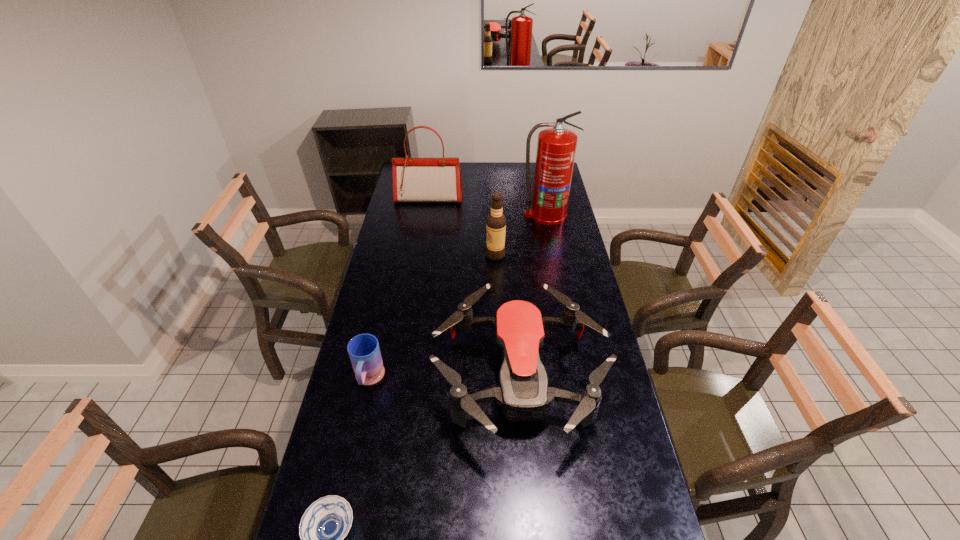
You are a GUI agent. You are given a task and a screenshot of the screen. Output one action in this format:
    pyautogui.click(x=<x>, y=<y>)
    Task: Click on the tallest object
    Image resolution: width=960 pixels, height=540 pixels.
    Given the screenshot: What is the action you would take?
    pos(556,147)

Image resolution: width=960 pixels, height=540 pixels. I want to click on the second farthest object, so click(x=556, y=147).

Where is `the second tallest object`? The image size is (960, 540). the second tallest object is located at coordinates (414, 179).

This screenshot has width=960, height=540. Find the location of `handbag`. handbag is located at coordinates (414, 179).

This screenshot has width=960, height=540. I want to click on the fourth shortest object, so click(x=495, y=222).

Find the location of a particular element. The width and height of the screenshot is (960, 540). the fourth nearest object is located at coordinates (495, 222).

Where is `drone`? drone is located at coordinates (523, 392).

In order to click on the fifth tallest object in this screenshot , I will do `click(364, 351)`.

You are a GUI agent. You are given a task and a screenshot of the screen. Output one action in this format:
    pyautogui.click(x=<x>, y=<y>)
    Task: Click on the free space located on the instruction side of the fifth nearest object
    Image resolution: width=960 pixels, height=540 pixels.
    Given the screenshot: What is the action you would take?
    pyautogui.click(x=555, y=263)

Image resolution: width=960 pixels, height=540 pixels. What are the coordinates of `vacant space located on the back of the farthest object` in the screenshot? It's located at [x=433, y=171].